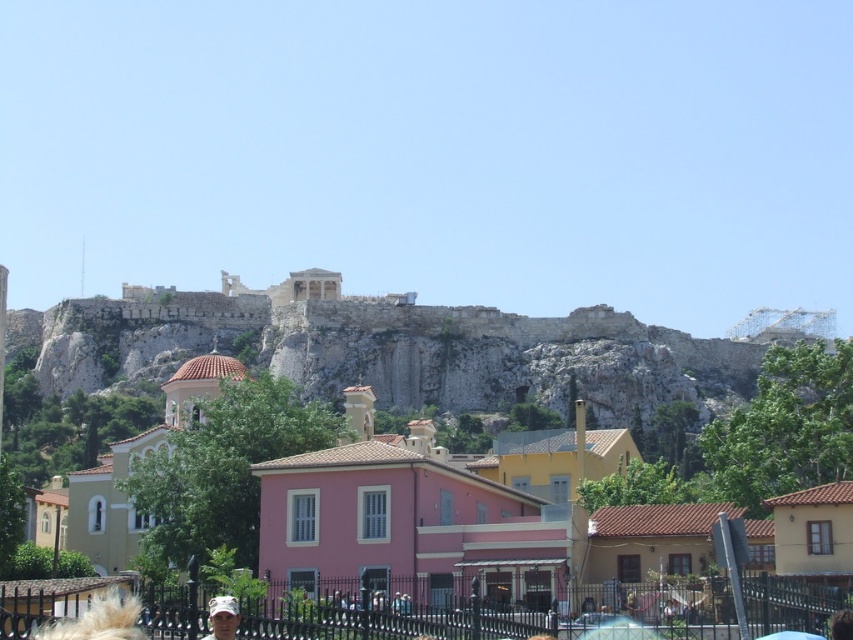
Question: Can you confirm if pink matte building at center is positioned to the left of camouflage fabric cap at lower center?

Choices:
 (A) no
 (B) yes

Answer: (A)

Question: Can you confirm if pink matte building at center is positioned to the left of camouflage fabric cap at lower center?

Choices:
 (A) no
 (B) yes

Answer: (A)

Question: Which point appears farthest from the camera in this image?

Choices:
 (A) coord(408,524)
 (B) coord(239,618)

Answer: (A)

Question: Observing the image, what is the correct spatial positioning of pink matte building at center in reference to camouflage fabric cap at lower center?

Choices:
 (A) above
 (B) below

Answer: (A)